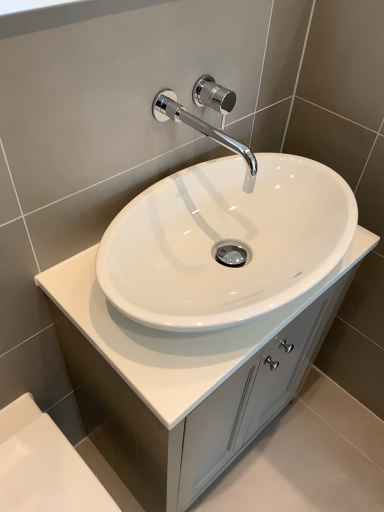
Question: Is polished chrome faucet at upper center inside the boundaries of white glossy bath at lower left, or outside?

Choices:
 (A) outside
 (B) inside

Answer: (A)

Question: In terms of width, does polished chrome faucet at upper center look wider or thinner when compared to white glossy bath at lower left?

Choices:
 (A) wide
 (B) thin

Answer: (B)

Question: Which object is the closest to the chrome/polished metal faucet at upper center?

Choices:
 (A) white glossy cabinet at center
 (B) polished chrome faucet at upper center
 (C) white glossy bath at lower left

Answer: (B)

Question: Based on their relative distances, which object is nearer to the white glossy cabinet at center?

Choices:
 (A) polished chrome faucet at upper center
 (B) chrome/polished metal faucet at upper center
 (C) white glossy bath at lower left

Answer: (C)